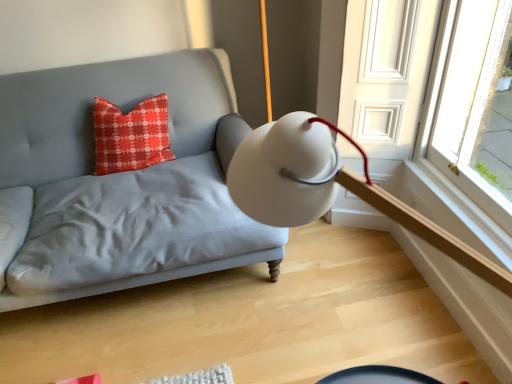
What do you see at coordinates (120, 182) in the screenshot? I see `matte gray fabric couch at center` at bounding box center [120, 182].

Find the location of a particular element. This screenshot has height=384, width=512. matte gray fabric couch at center is located at coordinates (120, 182).

Image resolution: width=512 pixels, height=384 pixels. Find the location of `matte gray fabric couch at center`. matte gray fabric couch at center is located at coordinates (120, 182).